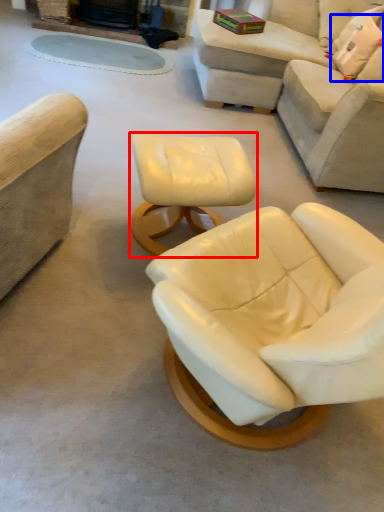
Question: Which object appears closest to the camera in this image, table (highlighted by a red box) or pillow (highlighted by a blue box)?

Choices:
 (A) table
 (B) pillow

Answer: (A)